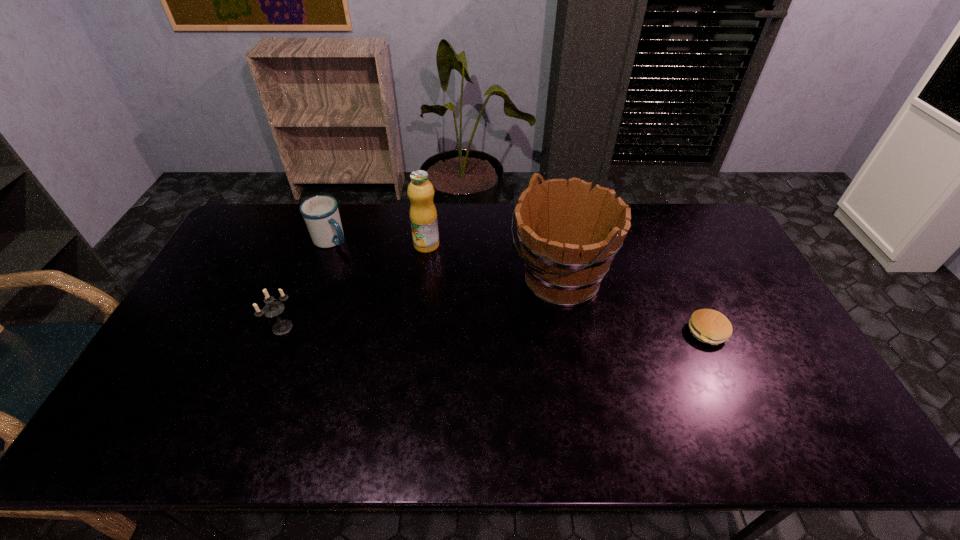
The image size is (960, 540). Identify the location of free space between the candle holder and the shortest object. (494, 329).

Identify the location of empty space between the second object from right to left and the third object from left to right. (493, 263).

Where is `vacant space that's between the fourth object from left to right and the shortest object`? vacant space that's between the fourth object from left to right and the shortest object is located at coordinates (634, 307).

Find the location of `vacant space that's between the fruit juice and the candle holder`. vacant space that's between the fruit juice and the candle holder is located at coordinates (354, 286).

Locate which object is the closest to the third object from right to left. Please provide its 2D coordinates. Your answer should be formatted as a tuple, i.e. [(x, y)], where the tuple contains the x and y coordinates of a point satisfying the conditions above.

[(321, 214)]

Locate which object ranks third in proximity to the shortest object. Please provide its 2D coordinates. Your answer should be formatted as a tuple, i.e. [(x, y)], where the tuple contains the x and y coordinates of a point satisfying the conditions above.

[(321, 214)]

Where is `free space that satisfies the following two spatial constraints: 1. on the front side of the rightmost object; 2. on the right side of the candle holder`? This screenshot has width=960, height=540. free space that satisfies the following two spatial constraints: 1. on the front side of the rightmost object; 2. on the right side of the candle holder is located at coordinates (280, 332).

Image resolution: width=960 pixels, height=540 pixels. I want to click on vacant space that satisfies the following two spatial constraints: 1. on the front side of the mug; 2. on the left side of the third object from right to left, so click(x=329, y=245).

Locate an element on the screen. The height and width of the screenshot is (540, 960). free space that satisfies the following two spatial constraints: 1. on the front side of the mug; 2. on the left side of the fourth object from left to right is located at coordinates (316, 282).